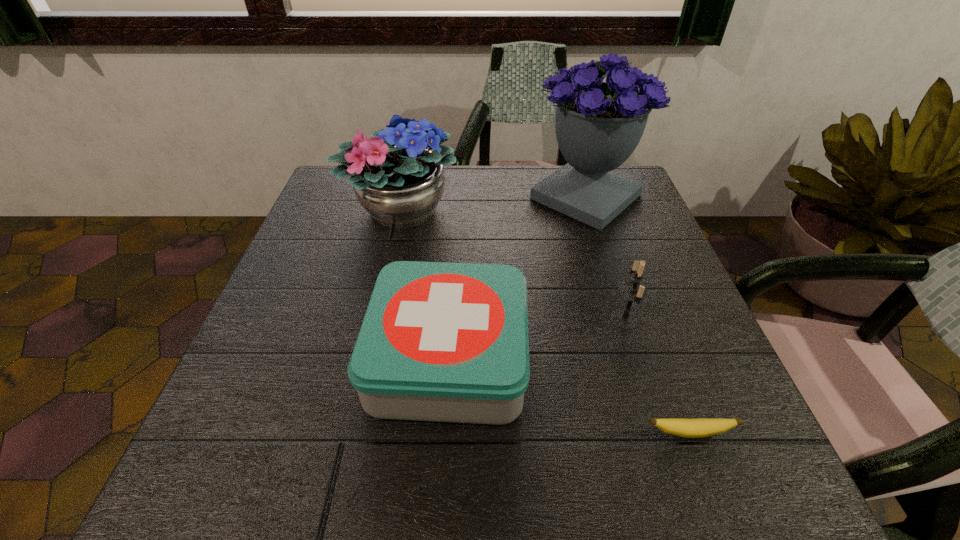
The height and width of the screenshot is (540, 960). I want to click on the tallest object, so click(598, 125).

Identify the location of the taller bouquet. This screenshot has height=540, width=960. (598, 125).

You are a GUI agent. You are given a task and a screenshot of the screen. Output one action in this format:
    pyautogui.click(x=<x>, y=<y>)
    Task: Click on the shorter bouquet
    This screenshot has height=540, width=960.
    Given the screenshot: What is the action you would take?
    pyautogui.click(x=399, y=182)

Where is `the second tallest object`? the second tallest object is located at coordinates (399, 182).

Identify the location of the third shortest object. This screenshot has height=540, width=960. (633, 292).

The image size is (960, 540). What are the coordinates of `the first-aid kit` in the screenshot? It's located at (448, 342).

The image size is (960, 540). Find the location of `banana`. banana is located at coordinates (701, 427).

Locate an element on the screen. The image size is (960, 540). free region located on the left of the right bouquet is located at coordinates (381, 197).

Image resolution: width=960 pixels, height=540 pixels. Find the location of `free space located 0.400m on the right of the left bouquet`. free space located 0.400m on the right of the left bouquet is located at coordinates (621, 211).

Identify the location of vacant region located 0.050m on the front of the candle holder. This screenshot has height=540, width=960. (638, 360).